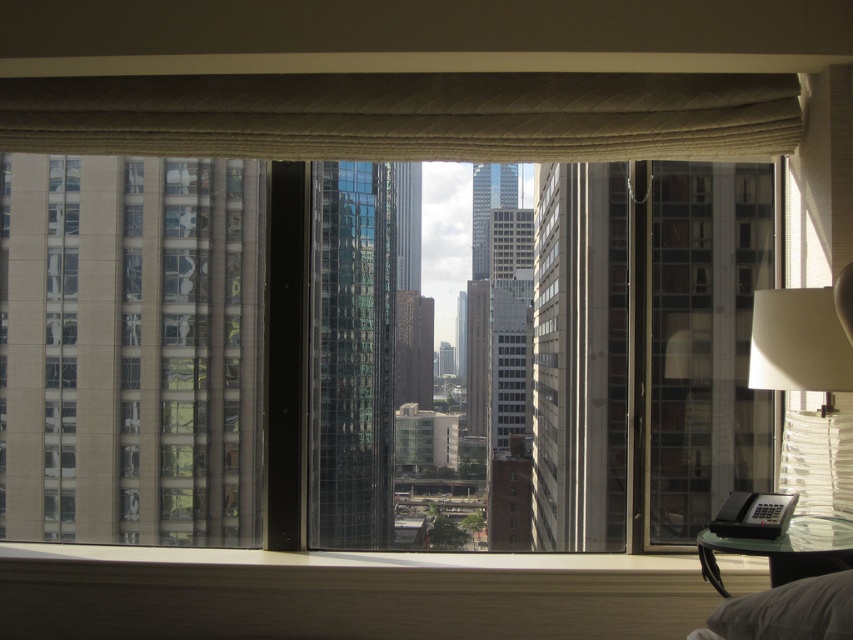
Can you confirm if transparent glass window at center is positioned to the right of beige textured curtain at upper center?

No, transparent glass window at center is not to the right of beige textured curtain at upper center.

This screenshot has width=853, height=640. I want to click on transparent glass window at center, so pyautogui.click(x=543, y=362).

This screenshot has width=853, height=640. I want to click on transparent glass window at center, so click(x=543, y=362).

Is beige textured curtain at upper center smaller than white textured lampshade at right?

No.

Does beige textured curtain at upper center appear on the right side of white textured lampshade at right?

In fact, beige textured curtain at upper center is to the left of white textured lampshade at right.

Locate an element on the screen. Image resolution: width=853 pixels, height=640 pixels. beige textured curtain at upper center is located at coordinates (405, 115).

In order to click on beige textured curtain at upper center in this screenshot , I will do `click(405, 115)`.

Between transparent glass window at center and white textured lampshade at right, which one has more height?

Standing taller between the two is transparent glass window at center.

Does transparent glass window at center appear on the right side of white textured lampshade at right?

No, transparent glass window at center is not to the right of white textured lampshade at right.

Is point (746, 337) in front of point (798, 513)?

No, it is not.

Locate an element on the screen. This screenshot has height=640, width=853. transparent glass window at center is located at coordinates (543, 362).